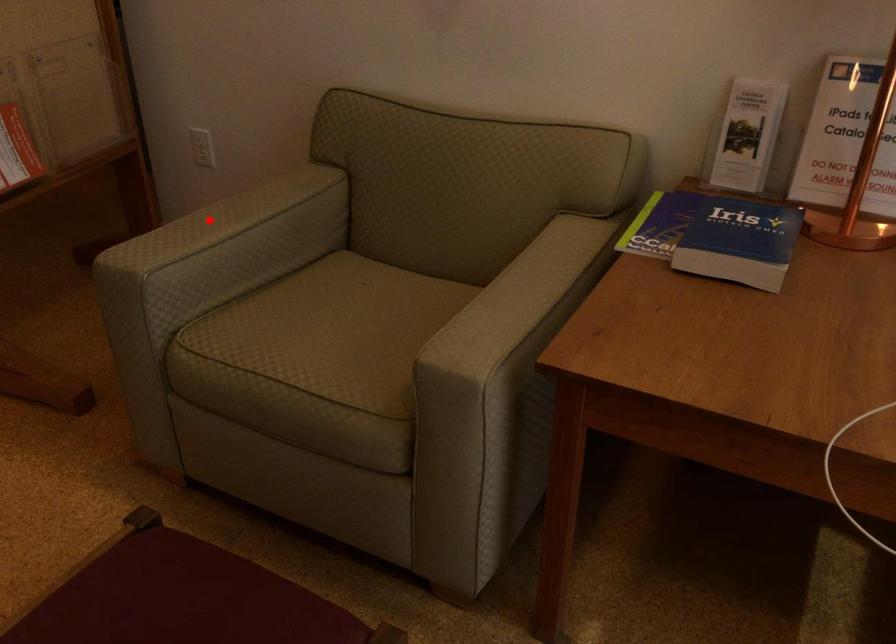
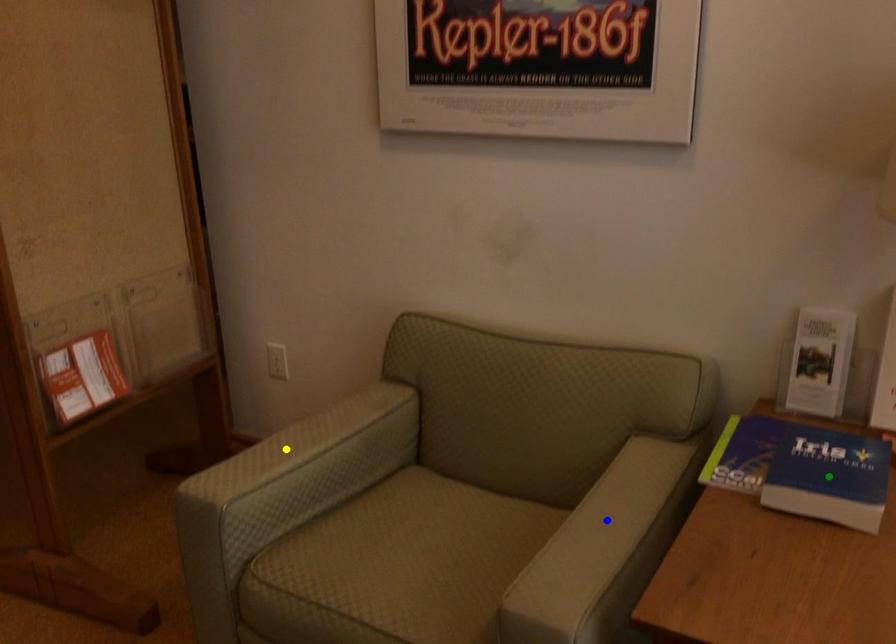
Question: I am providing you with two images of the same scene from different viewpoints. A red point is marked on the first image. You are given multiple points on the second image. Can you choose the point in image 2 that corresponds to the point in image 1?

Choices:
 (A) blue point
 (B) green point
 (C) yellow point

Answer: (C)